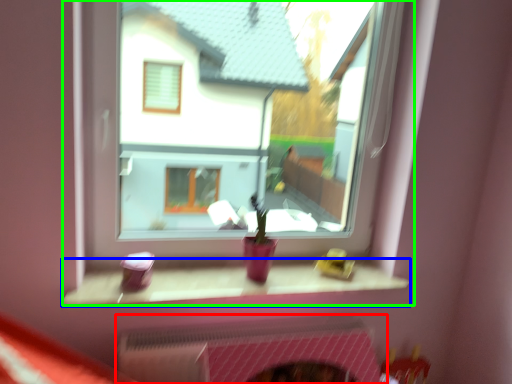
Question: Which is nearer to the fireplace (highlighted by a red box)? window sill (highlighted by a blue box) or window (highlighted by a green box).

Choices:
 (A) window sill
 (B) window

Answer: (A)